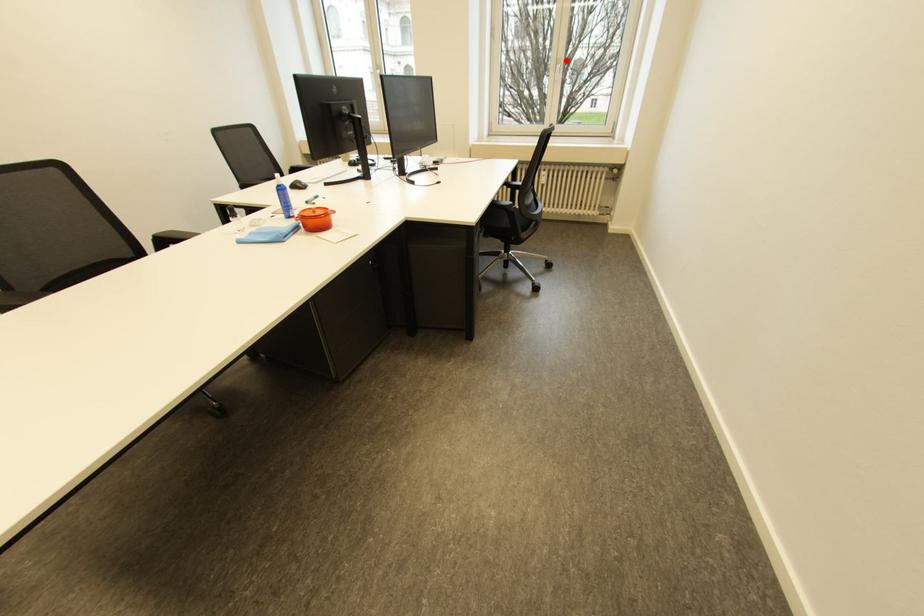
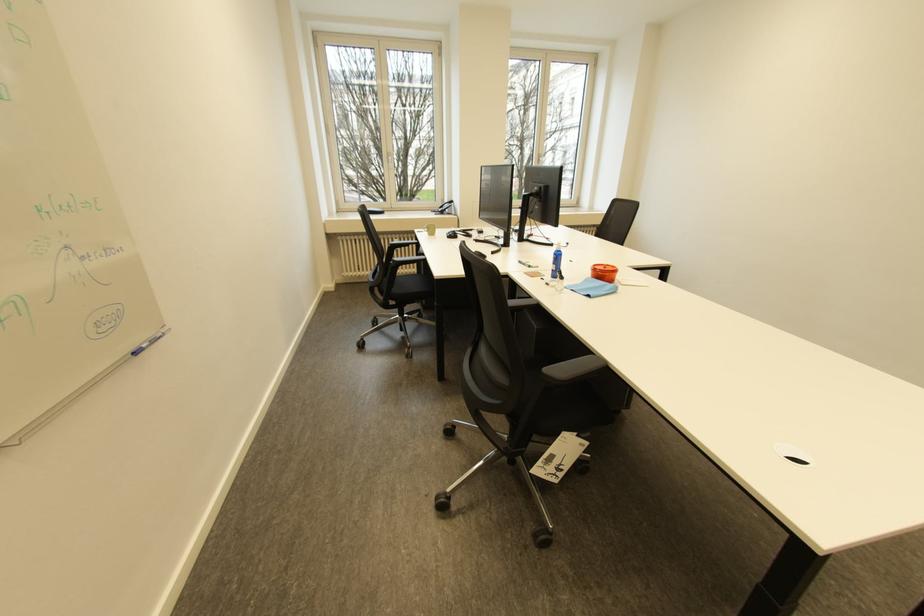
Question: A red point is marked in image1. In image2, is the corresponding 3D point closer to the camera or farther? Reply with the corresponding letter.

Choices:
 (A) The corresponding 3D point is closer.
 (B) The corresponding 3D point is farther.

Answer: (A)